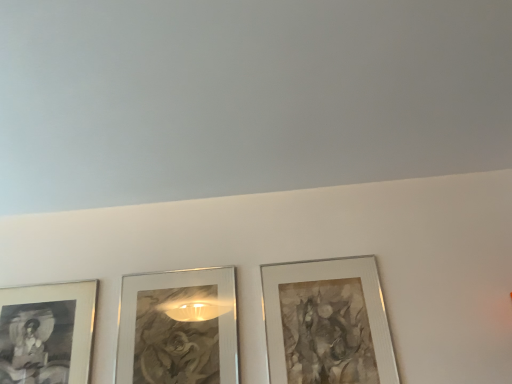
Question: Does silver metallic picture frame at center right, the third picture frame in the left-to-right sequence, appear on the left side of metallic silver picture frame at center, marked as the second picture frame in a left-to-right arrangement?

Choices:
 (A) yes
 (B) no

Answer: (B)

Question: From the image's perspective, is silver metallic picture frame at center right, placed as the 1th picture frame when sorted from right to left, below metallic silver picture frame at center, marked as the second picture frame in a left-to-right arrangement?

Choices:
 (A) yes
 (B) no

Answer: (B)

Question: Is silver metallic picture frame at center right, the third picture frame in the left-to-right sequence, positioned in front of metallic silver picture frame at center, which is the second picture frame in right-to-left order?

Choices:
 (A) no
 (B) yes

Answer: (B)

Question: From the image's perspective, would you say silver metallic picture frame at center right, placed as the 1th picture frame when sorted from right to left, is positioned over metallic silver picture frame at center, marked as the second picture frame in a left-to-right arrangement?

Choices:
 (A) yes
 (B) no

Answer: (A)

Question: Is silver metallic picture frame at center right, the third picture frame in the left-to-right sequence, bigger than metallic silver picture frame at center, which is the second picture frame in right-to-left order?

Choices:
 (A) no
 (B) yes

Answer: (B)

Question: From the image's perspective, is silver metallic picture frame at center right, placed as the 1th picture frame when sorted from right to left, positioned above or below metallic silver picture frame at center, which is the second picture frame in right-to-left order?

Choices:
 (A) below
 (B) above

Answer: (B)

Question: Visually, is silver metallic picture frame at center right, the third picture frame in the left-to-right sequence, positioned to the left or to the right of metallic silver picture frame at center, marked as the second picture frame in a left-to-right arrangement?

Choices:
 (A) right
 (B) left

Answer: (A)

Question: From a real-world perspective, is silver metallic picture frame at center right, the third picture frame in the left-to-right sequence, above or below metallic silver picture frame at center, marked as the second picture frame in a left-to-right arrangement?

Choices:
 (A) below
 (B) above

Answer: (A)

Question: Is point (313, 354) closer or farther from the camera than point (170, 340)?

Choices:
 (A) farther
 (B) closer

Answer: (B)

Question: Is metallic silver picture frame at center, which is the second picture frame in right-to-left order, in front of or behind silver metallic picture frame at center right, placed as the 1th picture frame when sorted from right to left, in the image?

Choices:
 (A) behind
 (B) front

Answer: (A)

Question: Considering the positions of metallic silver picture frame at center, which is the second picture frame in right-to-left order, and silver metallic picture frame at center right, placed as the 1th picture frame when sorted from right to left, in the image, is metallic silver picture frame at center, which is the second picture frame in right-to-left order, wider or thinner than silver metallic picture frame at center right, placed as the 1th picture frame when sorted from right to left,?

Choices:
 (A) thin
 (B) wide

Answer: (A)

Question: Is point (170, 352) closer or farther from the camera than point (308, 369)?

Choices:
 (A) closer
 (B) farther

Answer: (B)

Question: Based on their positions, is metallic silver picture frame at center, which is the second picture frame in right-to-left order, located to the left or right of silver metallic picture frame at center right, the third picture frame in the left-to-right sequence?

Choices:
 (A) right
 (B) left

Answer: (B)

Question: Based on their sizes in the image, would you say metallic silver picture frame at center, marked as the second picture frame in a left-to-right arrangement, is bigger or smaller than matte black picture frame at lower left, the 3th picture frame from the right?

Choices:
 (A) small
 (B) big

Answer: (B)

Question: In terms of width, does metallic silver picture frame at center, which is the second picture frame in right-to-left order, look wider or thinner when compared to matte black picture frame at lower left, placed as the 1th picture frame when sorted from left to right?

Choices:
 (A) thin
 (B) wide

Answer: (A)